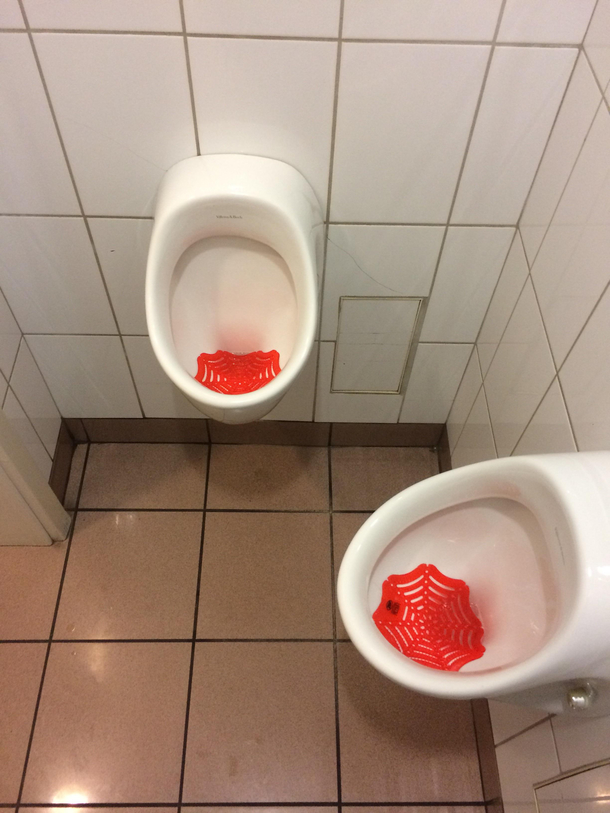
Where is `urinal`? urinal is located at coordinates (521, 607), (244, 298).